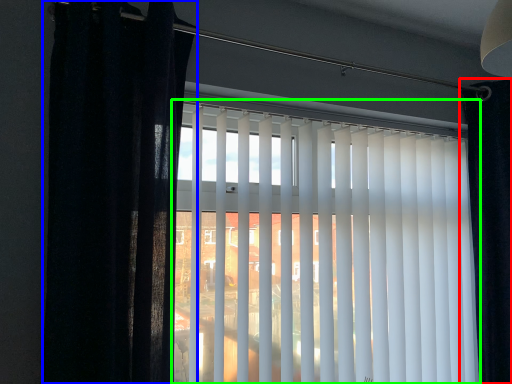
Question: Based on their relative distances, which object is nearer to curtain (highlighted by a red box)? Choose from curtain (highlighted by a blue box) and window blind (highlighted by a green box).

Choices:
 (A) curtain
 (B) window blind

Answer: (B)